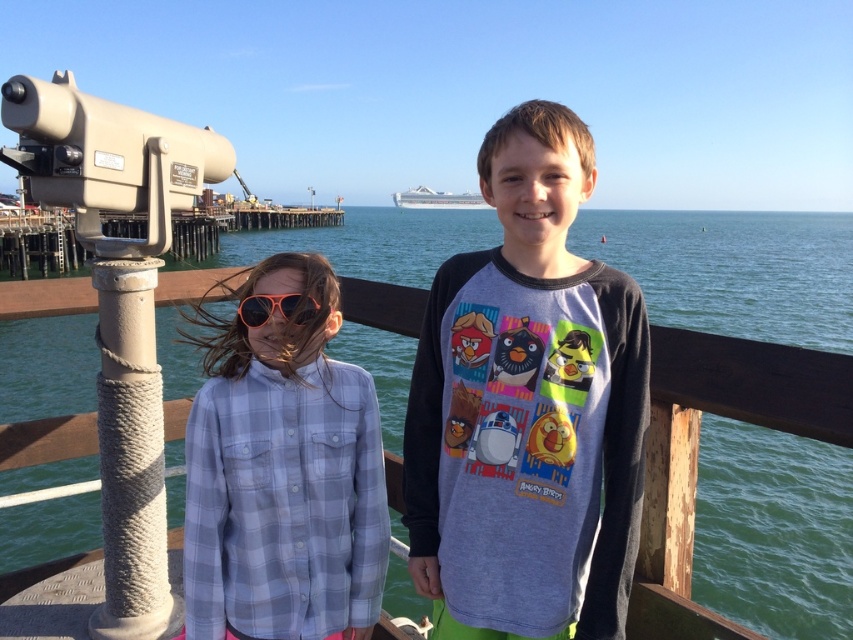
You are a photographer trying to capture a photo of both children standing on the pier. The coordinates of the girl are at point (405, 266) and the boy at point (399, 192). Based on their positions, which child is closer to the camera?

The girl at point (405, 266) is closer to the camera than the boy at point (399, 192) because the point (405, 266) is closer to the camera according to the coordinates provided.